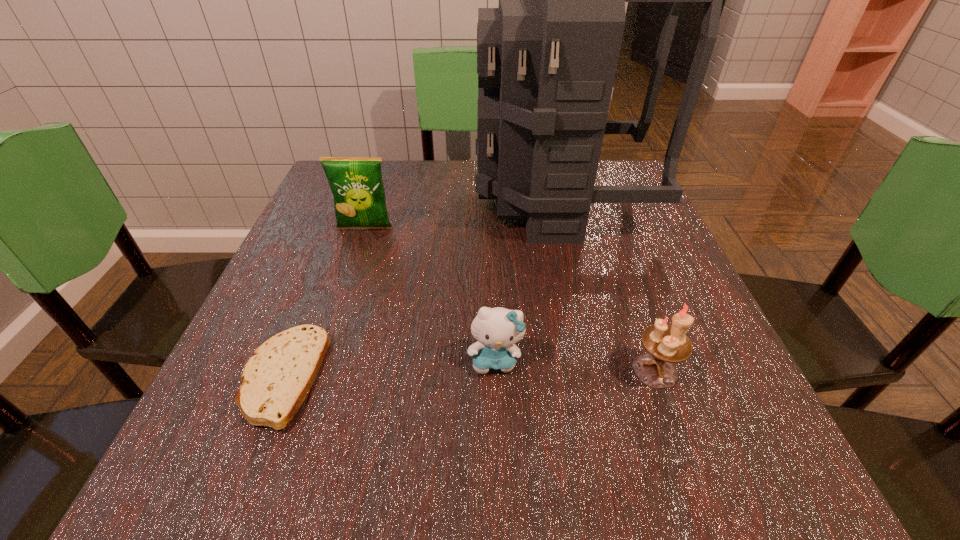
Locate an element on the screen. The height and width of the screenshot is (540, 960). the tallest object is located at coordinates (547, 57).

At what (x,y) coordinates should I click in order to perform the action: click on crisp (potato chip). Please return your answer as a coordinate pair (x, y). Looking at the image, I should click on pos(356,183).

Find the location of a particular element. candle holder is located at coordinates (665, 345).

Image resolution: width=960 pixels, height=540 pixels. I want to click on kitten, so click(497, 330).

Locate an element on the screen. This screenshot has height=540, width=960. the shortest object is located at coordinates (276, 380).

The image size is (960, 540). What are the coordinates of `vacant region located 0.370m on the front compartment of the backpack` in the screenshot? It's located at (316, 200).

The width and height of the screenshot is (960, 540). I want to click on vacant region located 0.110m on the front compartment of the backpack, so click(428, 200).

Find the location of a particular element. The height and width of the screenshot is (540, 960). blank area located 0.050m on the front compartment of the backpack is located at coordinates (454, 200).

Find the location of a particular element. free location located 0.120m on the front-facing side of the crisp (potato chip) is located at coordinates (350, 273).

I want to click on vacant region located on the left of the third tallest object, so click(x=428, y=370).